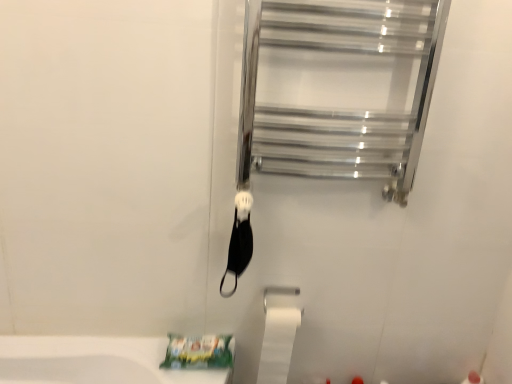
Question: Is white matte toilet paper at lower center positioned before clear glass towel rack at upper right?

Choices:
 (A) no
 (B) yes

Answer: (A)

Question: Can you confirm if white matte toilet paper at lower center is shorter than clear glass towel rack at upper right?

Choices:
 (A) no
 (B) yes

Answer: (B)

Question: From the image's perspective, is white matte toilet paper at lower center located above clear glass towel rack at upper right?

Choices:
 (A) no
 (B) yes

Answer: (A)

Question: Can you confirm if white matte toilet paper at lower center is thinner than clear glass towel rack at upper right?

Choices:
 (A) yes
 (B) no

Answer: (A)

Question: Is white matte toilet paper at lower center far from clear glass towel rack at upper right?

Choices:
 (A) yes
 (B) no

Answer: (B)

Question: Can you confirm if white matte toilet paper at lower center is wider than clear glass towel rack at upper right?

Choices:
 (A) yes
 (B) no

Answer: (B)

Question: Considering the relative sizes of clear glass towel rack at upper right and white matte toilet paper at lower center in the image provided, is clear glass towel rack at upper right taller than white matte toilet paper at lower center?

Choices:
 (A) yes
 (B) no

Answer: (A)

Question: From a real-world perspective, is clear glass towel rack at upper right beneath white matte toilet paper at lower center?

Choices:
 (A) yes
 (B) no

Answer: (B)

Question: Is clear glass towel rack at upper right shorter than white matte toilet paper at lower center?

Choices:
 (A) yes
 (B) no

Answer: (B)

Question: Is clear glass towel rack at upper right turned away from white matte toilet paper at lower center?

Choices:
 (A) yes
 (B) no

Answer: (B)

Question: From a real-world perspective, is clear glass towel rack at upper right over white matte toilet paper at lower center?

Choices:
 (A) yes
 (B) no

Answer: (A)

Question: Would you say clear glass towel rack at upper right is a long distance from white matte toilet paper at lower center?

Choices:
 (A) no
 (B) yes

Answer: (A)

Question: In terms of height, does clear glass towel rack at upper right look taller or shorter compared to white matte toilet paper at lower center?

Choices:
 (A) tall
 (B) short

Answer: (A)